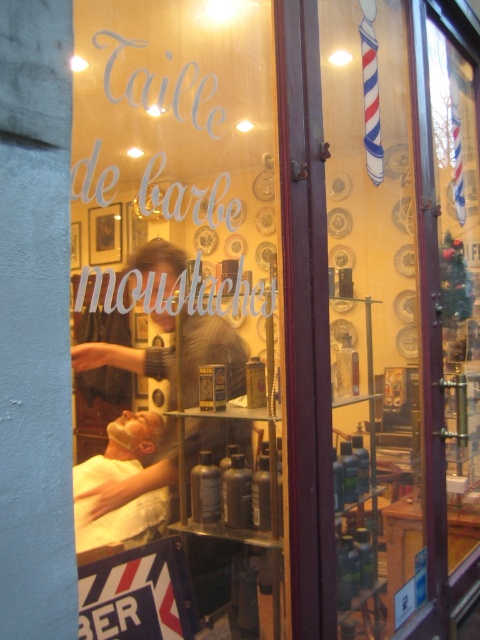
Question: Can you confirm if matte glass sign at center is positioned to the left of white cloth at lower left?

Choices:
 (A) yes
 (B) no

Answer: (B)

Question: Among these objects, which one is farthest from the camera?

Choices:
 (A) clear glass door at center
 (B) white cloth at lower left
 (C) matte glass sign at center

Answer: (A)

Question: Does clear glass door at center have a greater width compared to white cloth at lower left?

Choices:
 (A) yes
 (B) no

Answer: (A)

Question: Which of these objects is positioned closest to the clear glass door at center?

Choices:
 (A) matte glass sign at center
 (B) white cloth at lower left

Answer: (A)

Question: Is clear glass door at center positioned before white cloth at lower left?

Choices:
 (A) yes
 (B) no

Answer: (B)

Question: Which of the following is the closest to the observer?

Choices:
 (A) (126, 435)
 (B) (90, 595)
 (C) (411, 20)

Answer: (B)